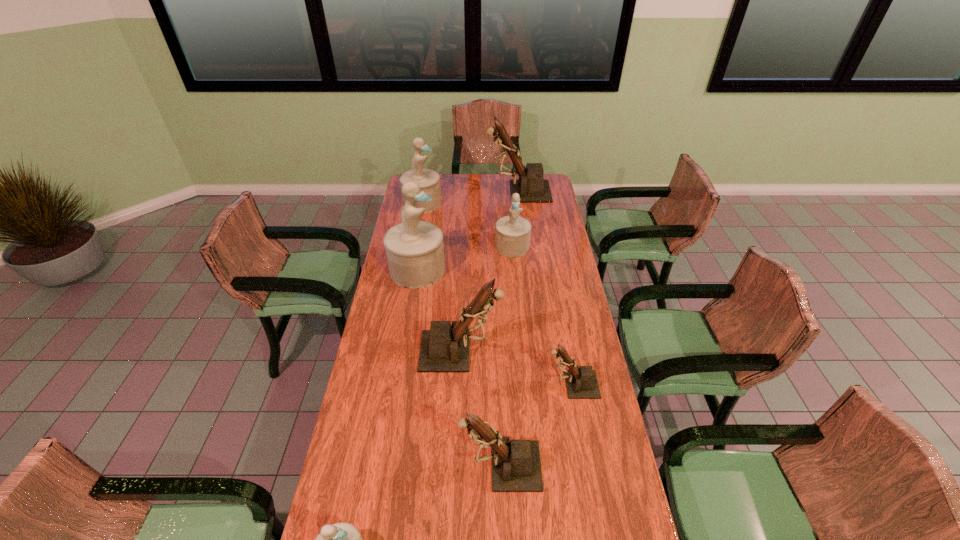
Find the location of `free space located on the front-facing side of the smallest brown figurine`. free space located on the front-facing side of the smallest brown figurine is located at coordinates (478, 384).

You are a GUI agent. You are given a task and a screenshot of the screen. Output one action in this format:
    pyautogui.click(x=<x>, y=<y>)
    Task: Click on the object located at the far left corner
    
    Given the screenshot: What is the action you would take?
    pyautogui.click(x=429, y=180)

Where is `object that is at the far right corner`? The image size is (960, 540). object that is at the far right corner is located at coordinates (531, 186).

This screenshot has height=540, width=960. What are the coordinates of `blank space at the far edge of the desktop` in the screenshot? It's located at (464, 174).

Identify the location of free spot at the left edge of the desktop. The height and width of the screenshot is (540, 960). (397, 391).

This screenshot has width=960, height=540. In the image, there is a desktop. Find the location of `vacant region at the right edge`. vacant region at the right edge is located at coordinates (570, 469).

What are the coordinates of `empty location between the second smallest white figurine and the smallest brown figurine` in the screenshot? It's located at (541, 315).

I want to click on empty location between the farthest brown figurine and the farthest white figurine, so click(470, 197).

Locate an element on the screen. empty location between the third smallest brown figurine and the smallest brown figurine is located at coordinates (516, 368).

Locate an element on the screen. This screenshot has width=960, height=540. vacant area between the third biggest white figurine and the smallest brown figurine is located at coordinates (541, 315).